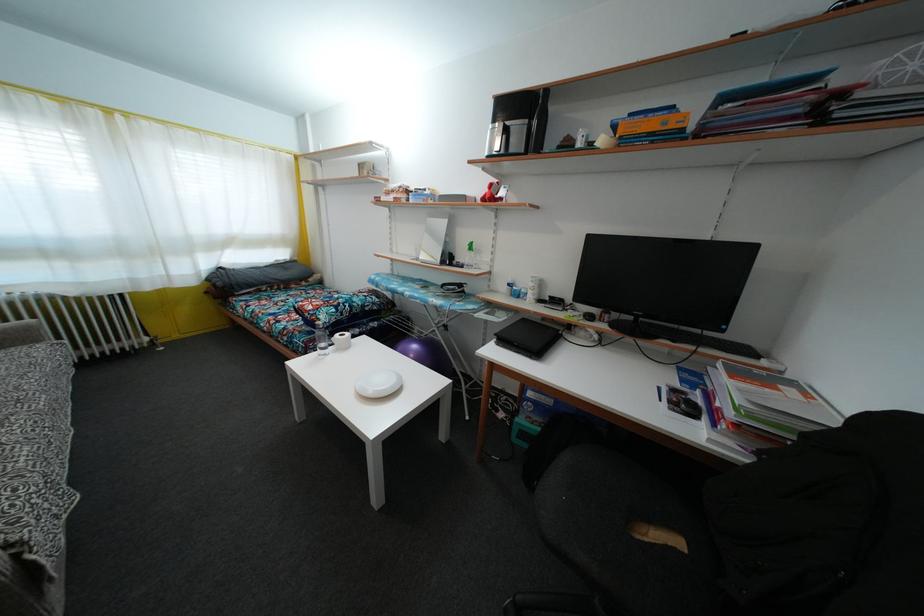
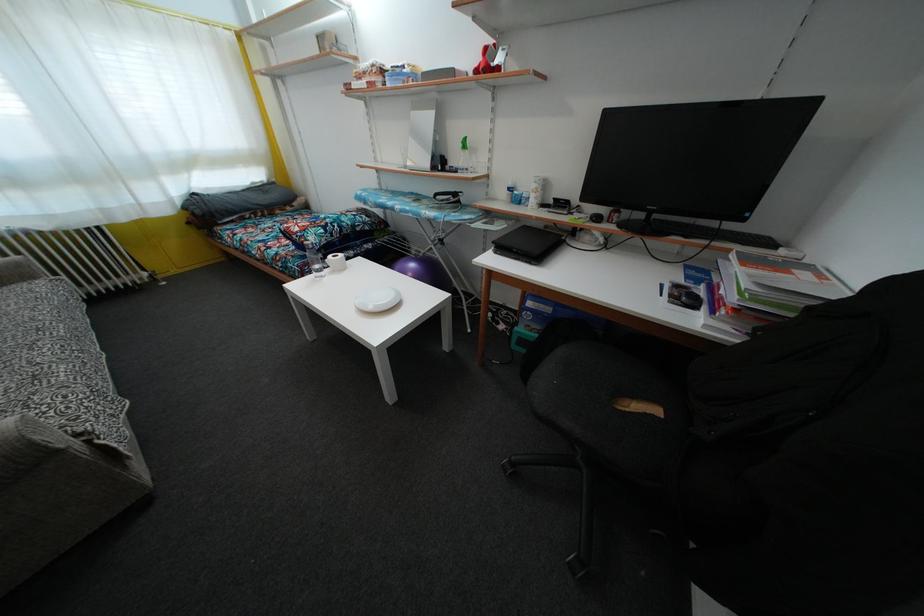
Locate, in the second image, the point that corresponds to point 682,549 in the first image.

(660, 418)